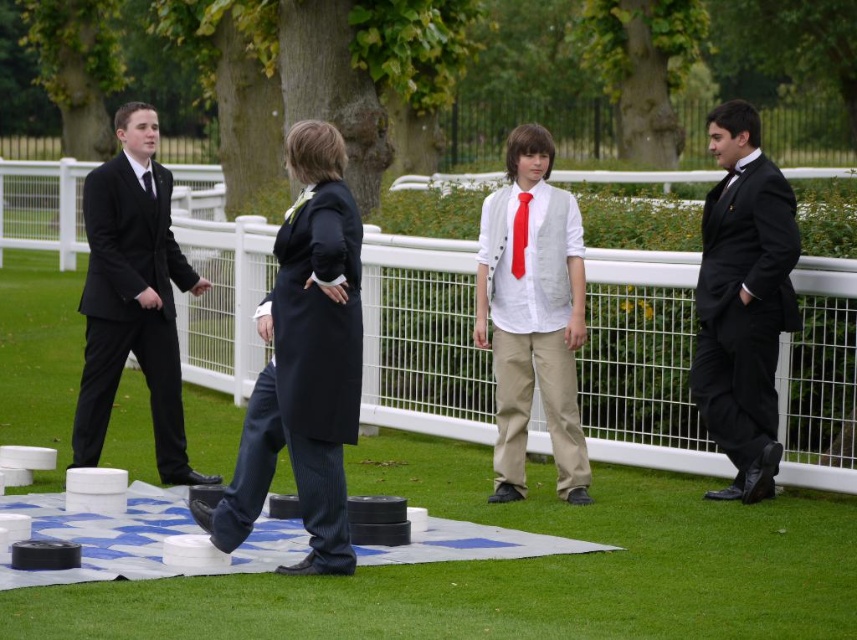
You are a photographer standing at the edge of the grassy area. You want to take a photo of the red satin tie at center without the white wire fence at center appearing in the background. Is this possible?

The white wire fence at center is positioned over the red satin tie at center, meaning the fence is closer to the camera than the tie. To avoid the fence in the background, you would need to adjust your angle or move closer to the tie so the fence is out of frame.

You are standing at the point marked by the coordinates point (642,362) in the image. Looking around, you see the white wire fence at center. Which direction should you walk to move away from the white wire fence at center?

The point (642,362) corresponds to the white wire fence at center, so walking in any direction away from this point would take you away from the white wire fence at center.